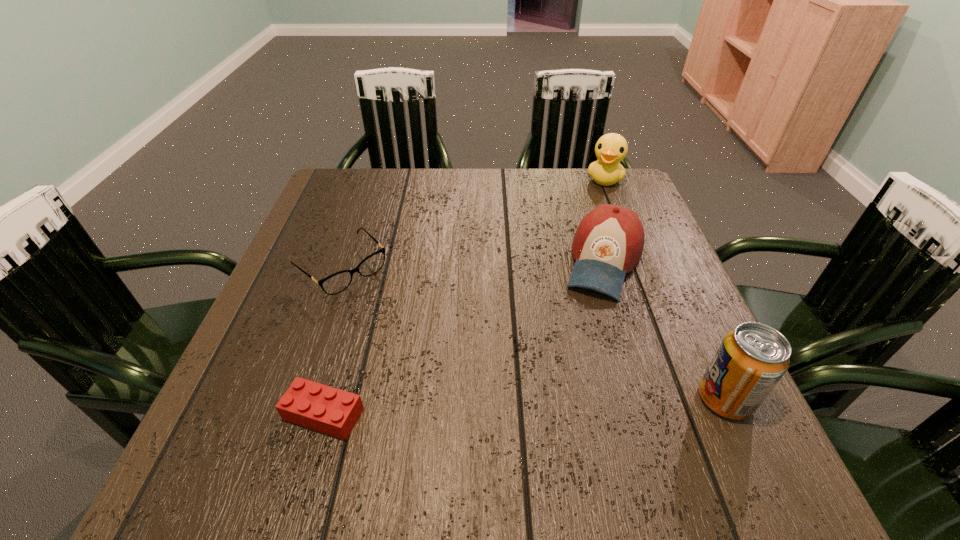
At what (x,y) coordinates should I click in order to perform the action: click on vacant space that's between the duck and the soda can. Please return your answer as a coordinate pair (x, y). Looking at the image, I should click on (664, 289).

Identify the location of vacant region between the duck and the Lego. (464, 297).

Select which object appears as the fourth closest to the duck. Please provide its 2D coordinates. Your answer should be formatted as a tuple, i.e. [(x, y)], where the tuple contains the x and y coordinates of a point satisfying the conditions above.

[(322, 408)]

Locate which object is the third closest to the spectacles. Please provide its 2D coordinates. Your answer should be formatted as a tuple, i.e. [(x, y)], where the tuple contains the x and y coordinates of a point satisfying the conditions above.

[(611, 149)]

The image size is (960, 540). Find the location of `blank space that satisfies the following two spatial constraints: 1. on the back side of the duck; 2. on the right side of the spectacles`. blank space that satisfies the following two spatial constraints: 1. on the back side of the duck; 2. on the right side of the spectacles is located at coordinates (372, 179).

Find the location of `free region that satisfies the following two spatial constraints: 1. on the front side of the third shortest object; 2. on the left side of the soda can`. free region that satisfies the following two spatial constraints: 1. on the front side of the third shortest object; 2. on the left side of the soda can is located at coordinates (645, 399).

The height and width of the screenshot is (540, 960). Identify the location of vacant region that satisfies the following two spatial constraints: 1. on the front side of the duck; 2. on the right side of the soda can. (691, 399).

Locate an element on the screen. Image resolution: width=960 pixels, height=540 pixels. vacant region that satisfies the following two spatial constraints: 1. on the back side of the Lego; 2. on the left side of the soda can is located at coordinates (328, 399).

You are a GUI agent. You are given a task and a screenshot of the screen. Output one action in this format:
    pyautogui.click(x=<x>, y=<y>)
    Task: Click on the vacant position in the image that satisfies the following two spatial constraints: 1. on the back side of the baseball cap; 2. on the left side of the duck
    This screenshot has width=960, height=540.
    Given the screenshot: What is the action you would take?
    pyautogui.click(x=578, y=179)